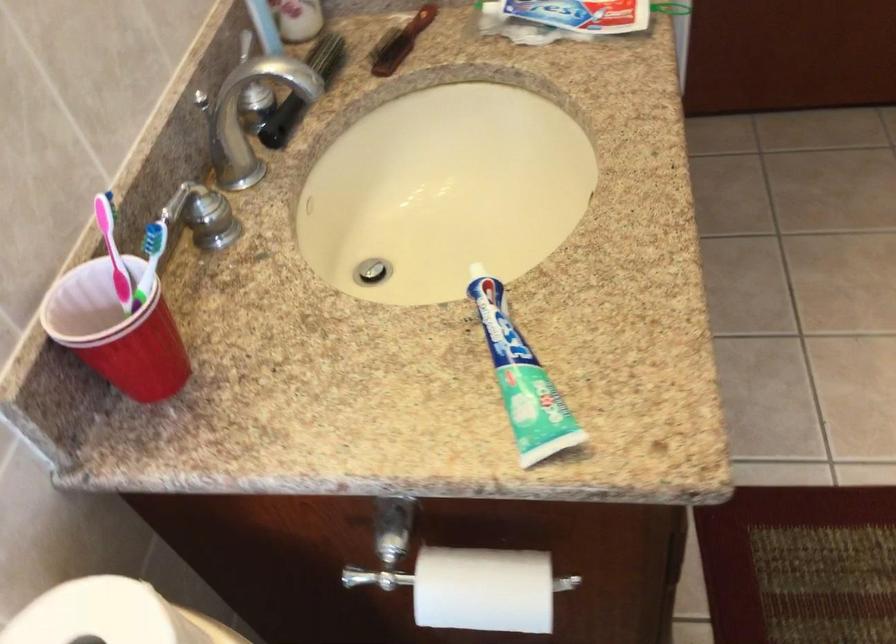
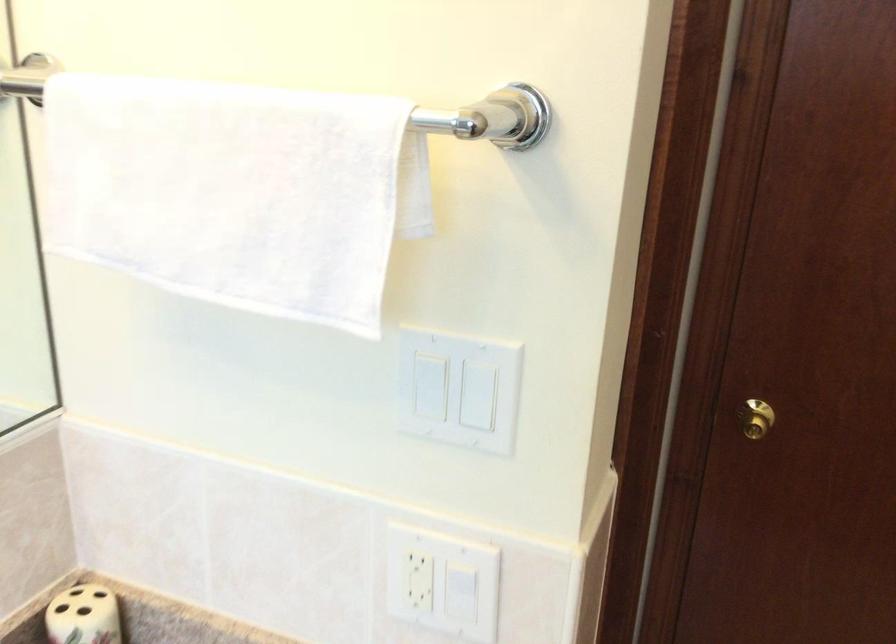
Question: How did the camera likely rotate?

Choices:
 (A) Left
 (B) Right
 (C) Up
 (D) Down

Answer: (C)